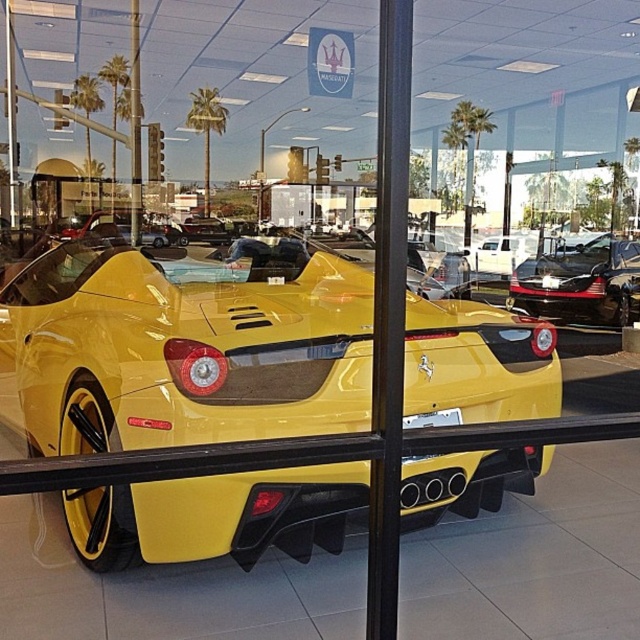
Question: Among these points, which one is nearest to the camera?

Choices:
 (A) (579, 268)
 (B) (358, 269)

Answer: (B)

Question: Is the position of yellow matte sports car at center less distant than that of shiny black car at center?

Choices:
 (A) no
 (B) yes

Answer: (B)

Question: Does yellow matte sports car at center come behind shiny black car at center?

Choices:
 (A) yes
 (B) no

Answer: (B)

Question: In this image, where is yellow matte sports car at center located relative to shiny black car at center?

Choices:
 (A) right
 (B) left

Answer: (B)